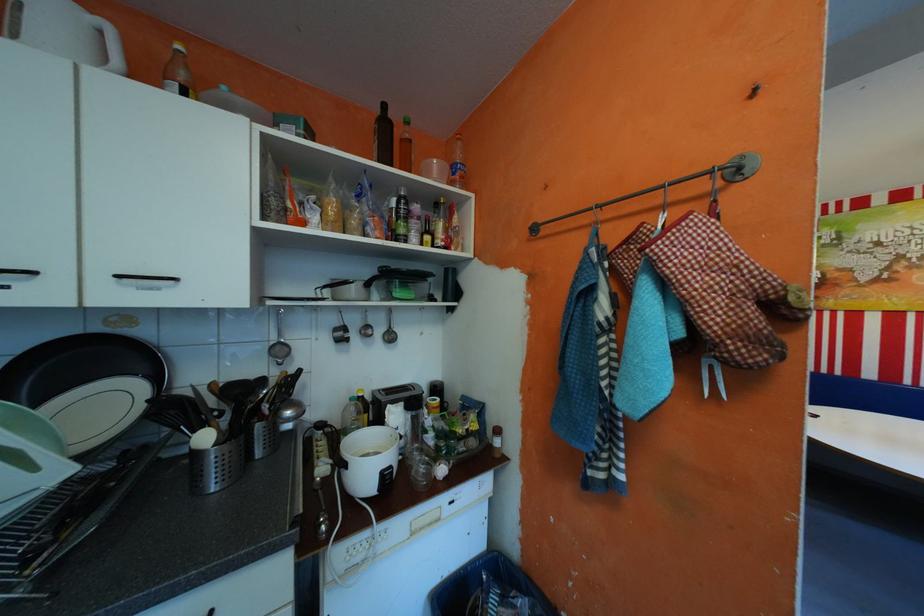
Find where to lift the bottle with yellow cap. Please return your answer as a coordinate pair (x, y).

(177, 73)